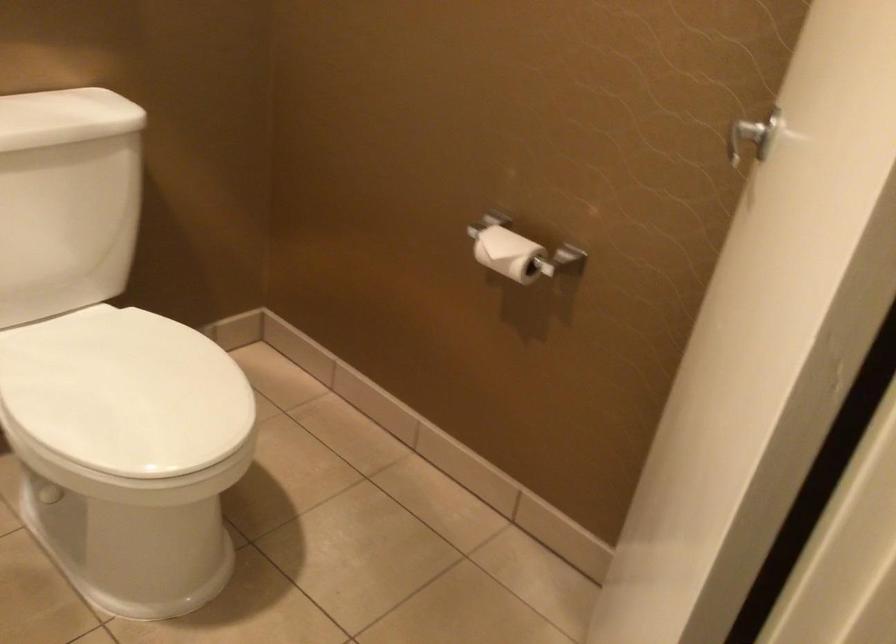
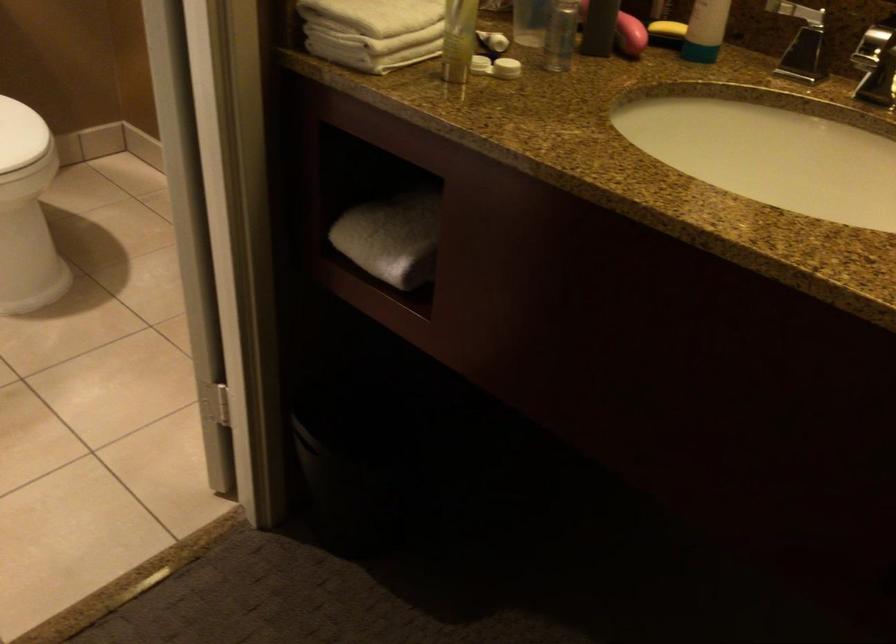
The point at (218,399) is marked in the first image. Where is the corresponding point in the second image?

(20, 135)